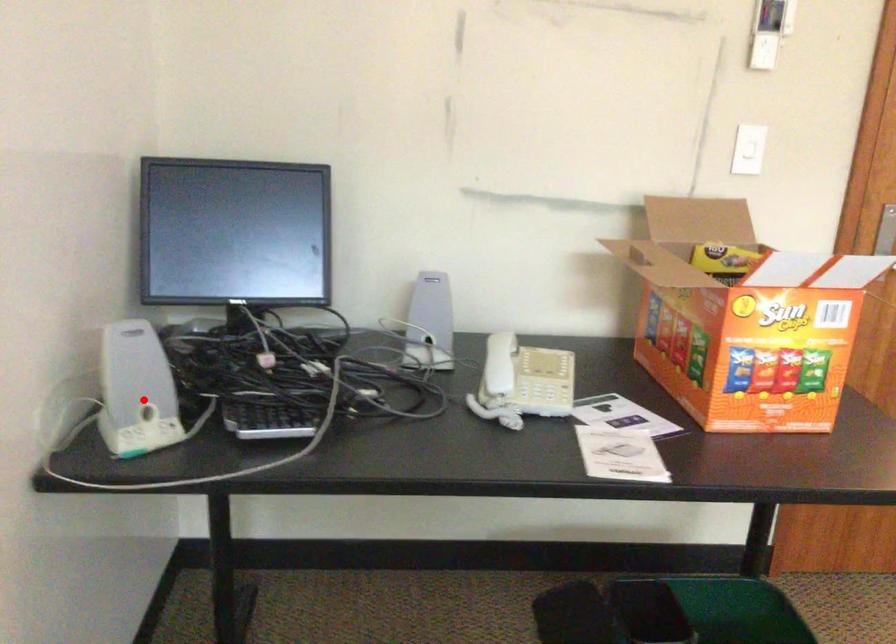
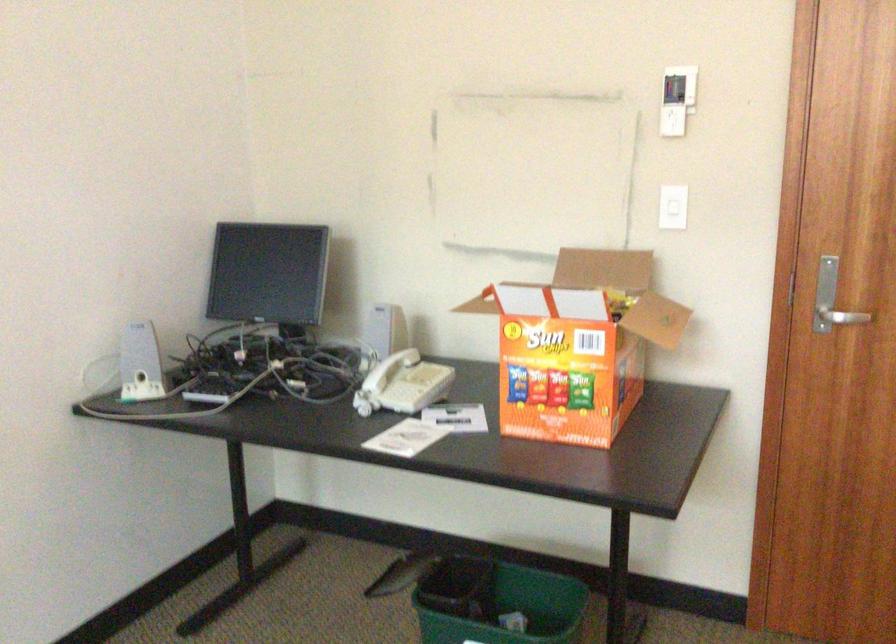
Question: I am providing you with two images of the same scene from different viewpoints. A red point is shown in image1. For the corresponding object point in image2, is it positioned nearer or farther from the camera?

Choices:
 (A) Nearer
 (B) Farther

Answer: (B)